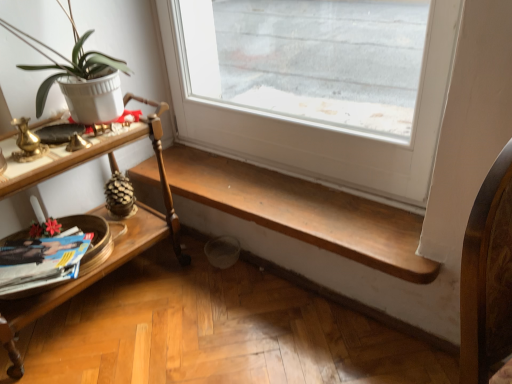
Where is `free point to the right of woodenmaterial/textureshelf at left`? The width and height of the screenshot is (512, 384). free point to the right of woodenmaterial/textureshelf at left is located at coordinates (215, 313).